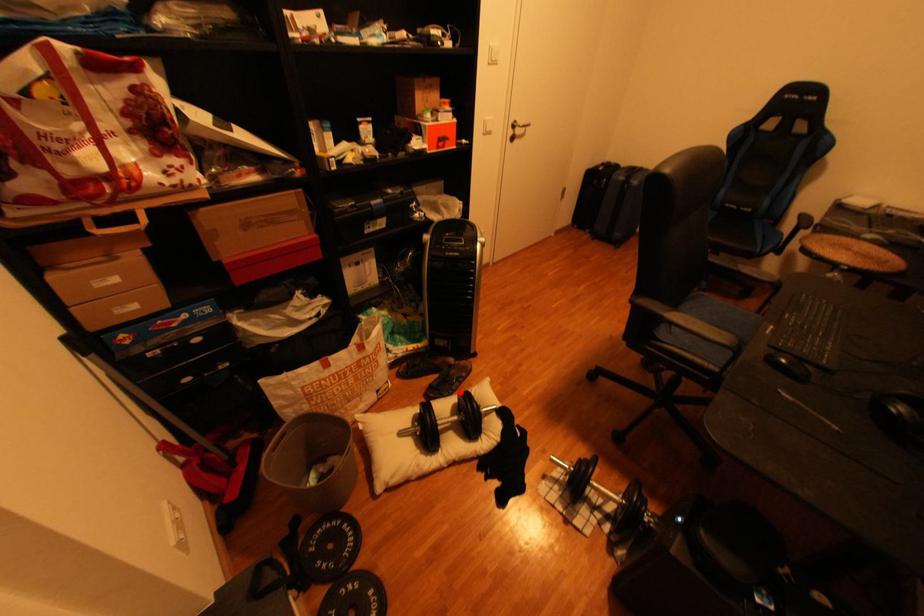
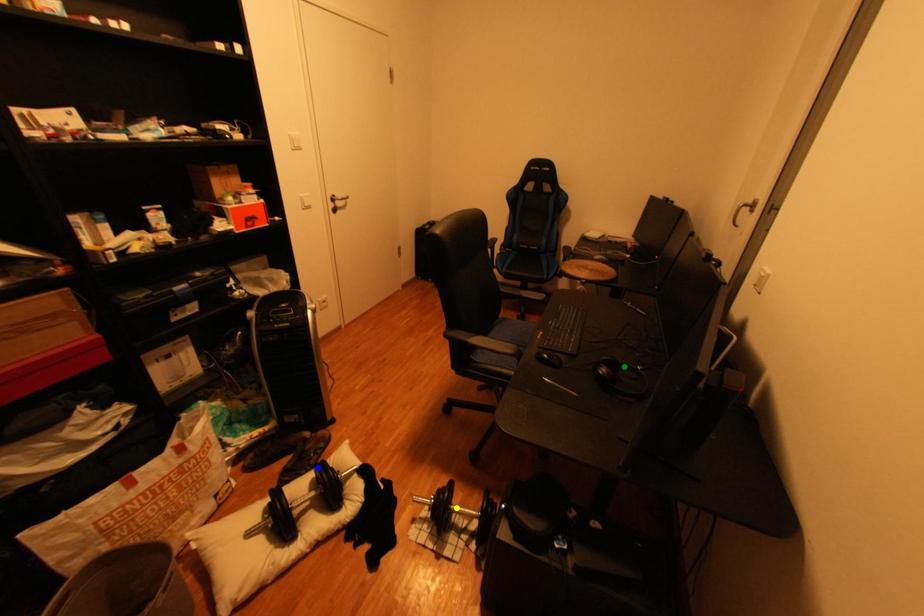
Question: I am providing you with two images of the same scene from different viewpoints. A red point is marked on the first image. You are given multiple points on the second image. Which point in image 2 is actually the same real-world point as the red point in image 1?

Choices:
 (A) blue point
 (B) green point
 (C) yellow point

Answer: (A)